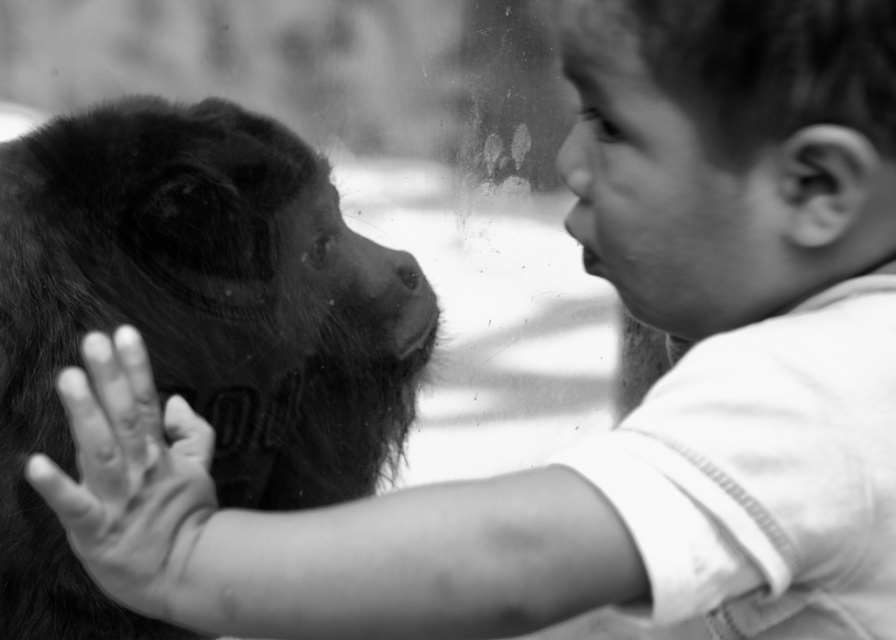
Question: Can you confirm if black furry monkey at left is positioned to the right of smooth skin hand at center?

Choices:
 (A) yes
 (B) no

Answer: (B)

Question: Which object appears closest to the camera in this image?

Choices:
 (A) smooth skin hand at center
 (B) black furry monkey at left

Answer: (A)

Question: Which point is farther to the camera?

Choices:
 (A) (93, 556)
 (B) (136, 192)

Answer: (B)

Question: Considering the relative positions of black furry monkey at left and smooth skin hand at center in the image provided, where is black furry monkey at left located with respect to smooth skin hand at center?

Choices:
 (A) above
 (B) below

Answer: (A)

Question: Can you confirm if black furry monkey at left is positioned above smooth skin hand at center?

Choices:
 (A) no
 (B) yes

Answer: (B)

Question: Among these points, which one is farthest from the camera?

Choices:
 (A) (204, 499)
 (B) (0, 337)

Answer: (B)